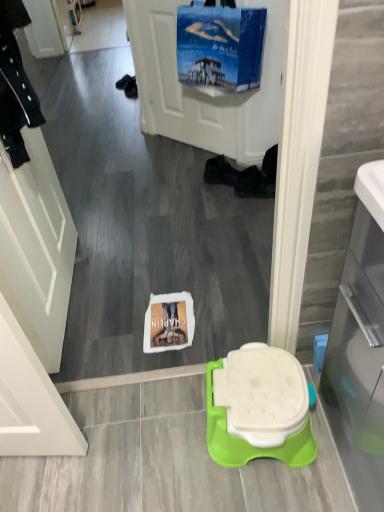
Locate an element on the screen. The width and height of the screenshot is (384, 512). vacant area that lies between white matte screen door at left, arranged as the 1th screen door when ordered from the bottom, and black fabric shoe at center, which is counted as the second footwear, starting from the left is located at coordinates (150, 247).